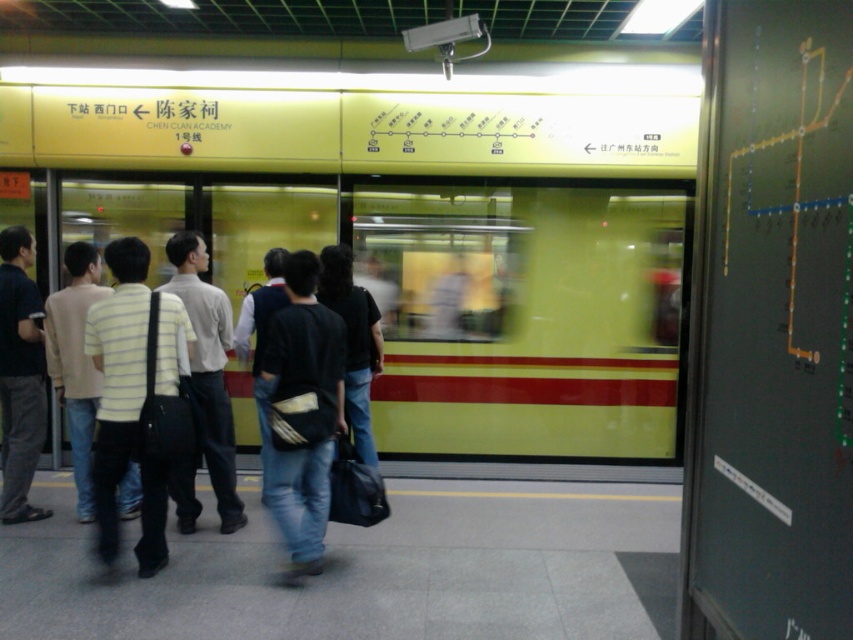
Question: Among these points, which one is nearest to the camera?

Choices:
 (A) (627, 394)
 (B) (24, 392)
 (C) (161, 358)

Answer: (C)

Question: Does striped cotton shirt at left have a larger size compared to striped cotton shirt at center?

Choices:
 (A) yes
 (B) no

Answer: (B)

Question: Which object appears farthest from the camera in this image?

Choices:
 (A) yellow matte train at center
 (B) striped cotton shirt at center

Answer: (A)

Question: Does striped cotton shirt at left appear on the right side of dark gray jeans at left?

Choices:
 (A) yes
 (B) no

Answer: (A)

Question: Which object is farther from the camera taking this photo?

Choices:
 (A) dark gray jeans at left
 (B) black matte backpack at center

Answer: (A)

Question: Can you confirm if striped cotton shirt at left is positioned below striped cotton shirt at center?

Choices:
 (A) no
 (B) yes

Answer: (B)